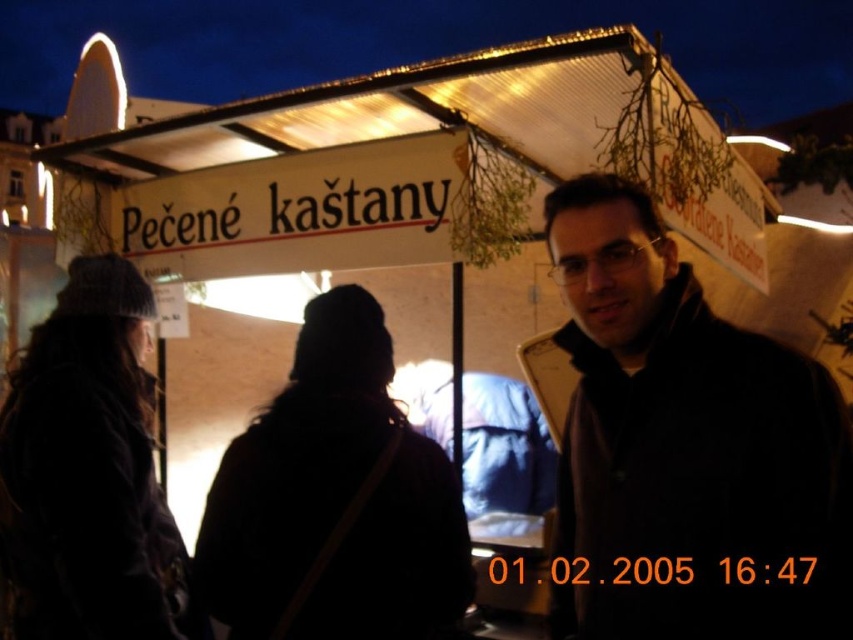
You are a photographer trying to capture both the black woolen hat at center and the knitted wool hat at left in a single shot. Which hat is closer to the camera?

The black woolen hat at center is shorter than the knitted wool hat at left, so the knitted wool hat at left is closer to the camera.

You are a photographer at the market and want to capture both the black woolen hat at center and the knitted wool hat at left in one frame. Which hat will appear smaller in the photo?

The black woolen hat at center will appear smaller in the photo because it has a smaller size compared to the knitted wool hat at left.

You are a photographer trying to capture a clear photo of the knitted wool hat at left and the black matte jacket at center. Since you want to focus on the hat, which object should you adjust your camera focus to prioritize?

The black matte jacket at center is in front of the knitted wool hat at left, so to focus on the hat, you need to adjust the camera focus to the knitted wool hat at left.